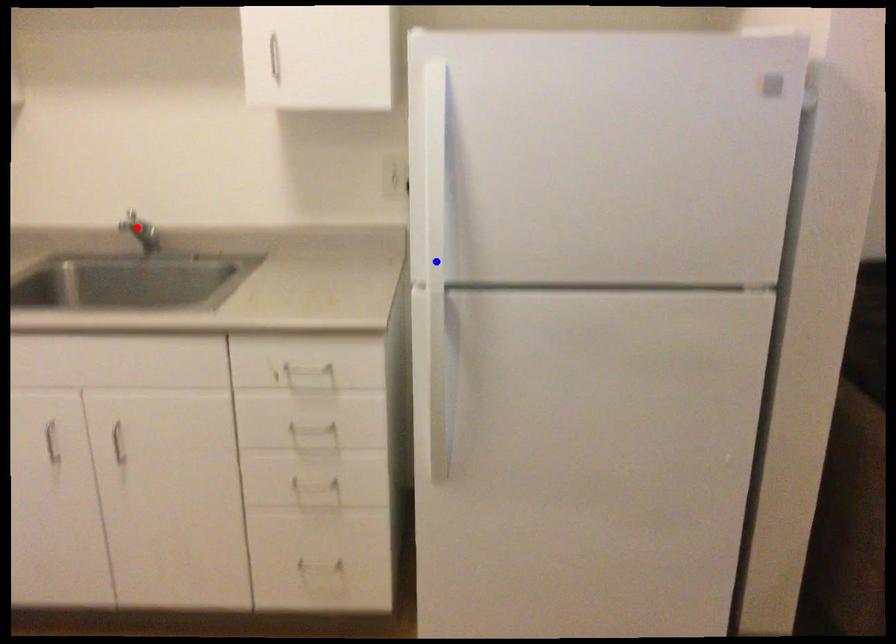
Question: In the image, two points are highlighted. Which point is nearer to the camera? Reply with the corresponding letter.

Choices:
 (A) blue point
 (B) red point

Answer: (A)